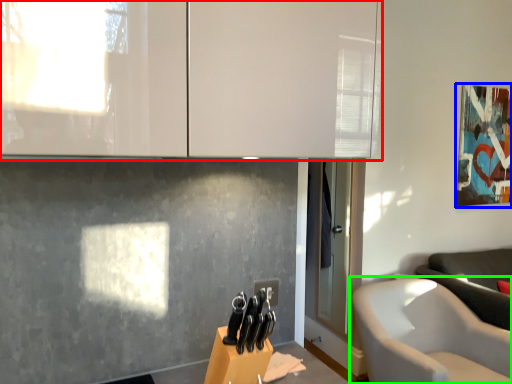
Question: Which object is the closest to the cabinetry (highlighted by a red box)? Choose among these: picture frame (highlighted by a blue box) or chair (highlighted by a green box).

Choices:
 (A) picture frame
 (B) chair

Answer: (B)